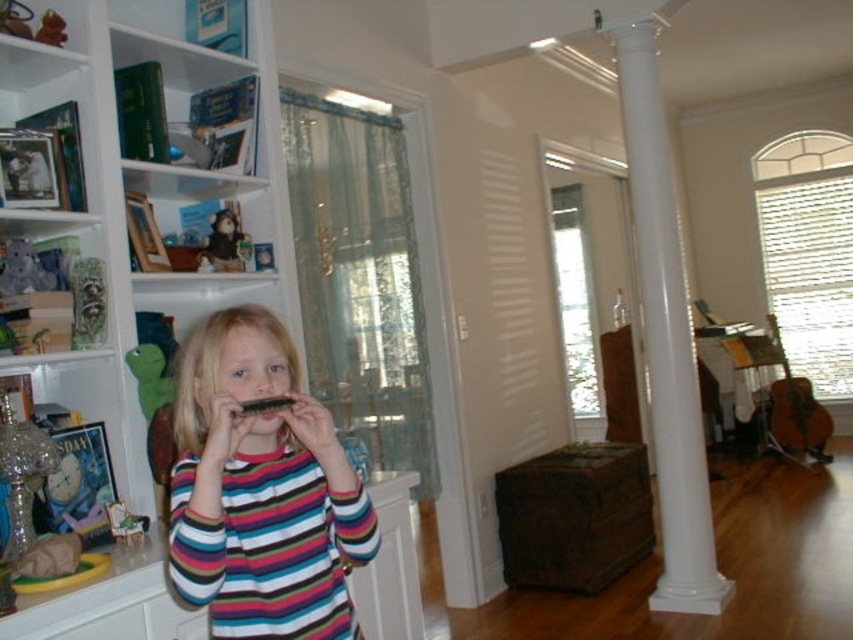
Based on the photo, you are a visitor in this room and want to place a new book on the white wood bookcase at left without moving the harmonica. Can you walk around the matte black harmonica at center to reach the bookcase?

The white wood bookcase at left is to the left of the matte black harmonica at center, so you can walk around the harmonica to the left side to access the bookcase.

You are a photographer trying to capture a closeup of the matte black harmonica at center without the white smooth column at center blocking the shot. Can you fit the harmonica into the frame without the column overlapping it?

The white smooth column at center is larger in size than matte black harmonica at center, so it might block the harmonica. To avoid overlap, position the camera so the harmonica is framed outside the column area.